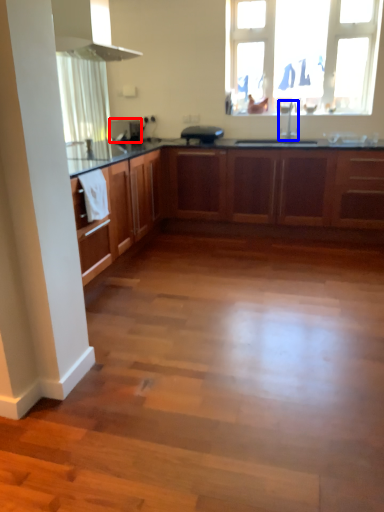
Question: Which object is closer to the camera taking this photo, appliance (highlighted by a red box) or tap (highlighted by a blue box)?

Choices:
 (A) appliance
 (B) tap

Answer: (B)